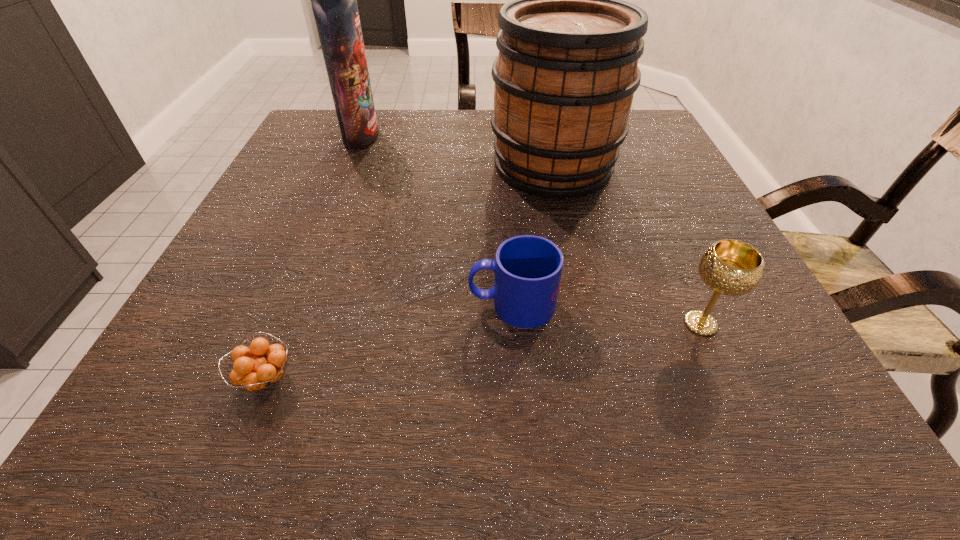
At what (x,y) coordinates should I click in order to perform the action: click on free space between the shortest object and the shampoo. Please return your answer as a coordinate pair (x, y). The image size is (960, 540). Looking at the image, I should click on (314, 258).

Where is `free spot between the third shortest object and the mug`? The height and width of the screenshot is (540, 960). free spot between the third shortest object and the mug is located at coordinates (607, 314).

Locate an element on the screen. Image resolution: width=960 pixels, height=540 pixels. blank region between the fourth shortest object and the shampoo is located at coordinates (457, 151).

This screenshot has width=960, height=540. In order to click on free space between the mug and the shampoo in this screenshot , I will do `click(437, 220)`.

Locate an element on the screen. The image size is (960, 540). free point between the shampoo and the shortest object is located at coordinates (314, 258).

The width and height of the screenshot is (960, 540). I want to click on vacant region between the chalice and the orange fruit, so click(483, 351).

Find the location of a particular element. Image resolution: width=960 pixels, height=540 pixels. free space between the fourth shortest object and the shampoo is located at coordinates (457, 151).

Locate an element on the screen. free space between the chalice and the shampoo is located at coordinates (531, 230).

Find the location of `object that is the second closest to the third shortest object`. object that is the second closest to the third shortest object is located at coordinates (567, 69).

Select which object appears as the second closest to the third tallest object. Please provide its 2D coordinates. Your answer should be formatted as a tuple, i.e. [(x, y)], where the tuple contains the x and y coordinates of a point satisfying the conditions above.

[(567, 69)]